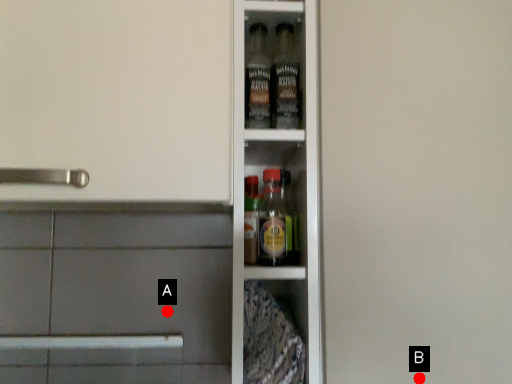
Question: Two points are circled on the image, labeled by A and B beside each circle. Which point is closer to the camera?

Choices:
 (A) A is closer
 (B) B is closer

Answer: (B)